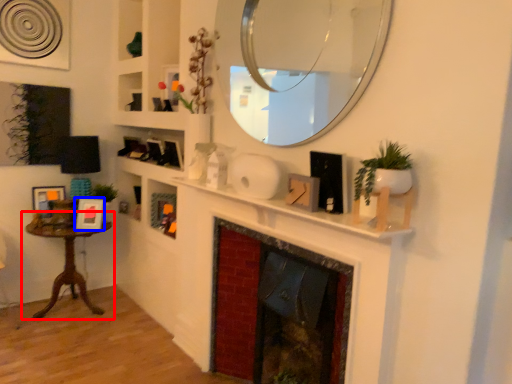
Question: Among these objects, which one is farthest to the camera, table (highlighted by a red box) or picture frame (highlighted by a blue box)?

Choices:
 (A) table
 (B) picture frame

Answer: (B)